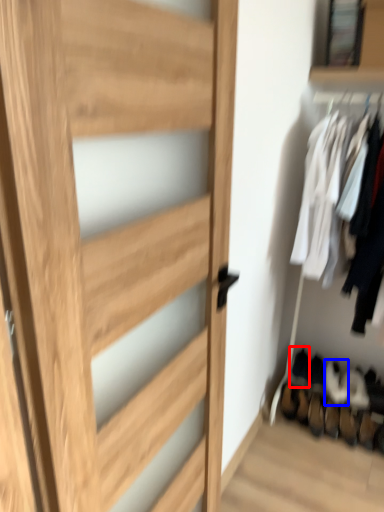
Question: Which object is closer to the camera taking this photo, shoe (highlighted by a red box) or shoe (highlighted by a blue box)?

Choices:
 (A) shoe
 (B) shoe

Answer: (B)